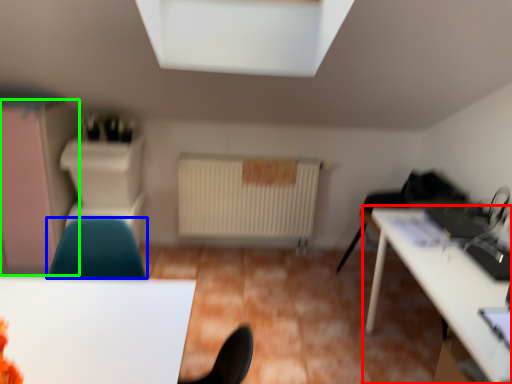
Question: Estimate the real-world distances between objects in this image. Which object is closer to table (highlighted by a red box), chair (highlighted by a blue box) or dresser (highlighted by a green box)?

Choices:
 (A) chair
 (B) dresser

Answer: (A)